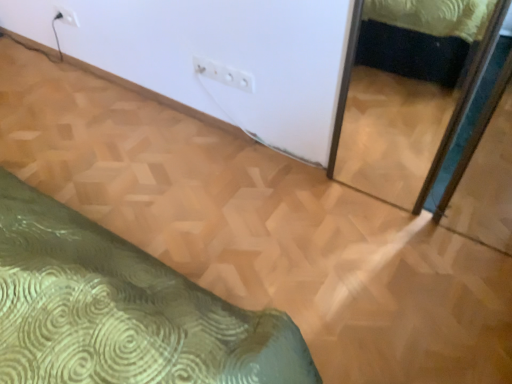
This screenshot has width=512, height=384. What do you see at coordinates (224, 74) in the screenshot?
I see `white plastic electric outlet at upper center, placed as the second electric outlet when sorted from left to right` at bounding box center [224, 74].

Locate an element on the screen. This screenshot has height=384, width=512. white plastic electric outlet at upper center, which appears as the 2th electric outlet when viewed from the top is located at coordinates (224, 74).

How much space does white plastic electric outlet at upper center, placed as the second electric outlet when sorted from left to right, occupy horizontally?

The width of white plastic electric outlet at upper center, placed as the second electric outlet when sorted from left to right, is 0.68 inches.

Find the location of a particular element. The width and height of the screenshot is (512, 384). white plastic electric outlet at upper left, which appears as the 2th electric outlet when viewed from the right is located at coordinates (66, 16).

Describe the element at coordinates (66, 16) in the screenshot. I see `white plastic electric outlet at upper left, the second electric outlet when ordered from bottom to top` at that location.

This screenshot has height=384, width=512. Find the location of `white plastic electric outlet at upper center, which appears as the second electric outlet when viewed from the back`. white plastic electric outlet at upper center, which appears as the second electric outlet when viewed from the back is located at coordinates (224, 74).

Between white plastic electric outlet at upper left, which ranks as the 1th electric outlet in back-to-front order, and white plastic electric outlet at upper center, which appears as the 2th electric outlet when viewed from the top, which one appears on the left side from the viewer's perspective?

Positioned to the left is white plastic electric outlet at upper left, which ranks as the 1th electric outlet in back-to-front order.

Which object is closer to the camera taking this photo, white plastic electric outlet at upper left, which is the second electric outlet in front-to-back order, or white plastic electric outlet at upper center, which appears as the 2th electric outlet when viewed from the top?

white plastic electric outlet at upper center, which appears as the 2th electric outlet when viewed from the top, is more forward.

Which is behind, point (68, 14) or point (246, 83)?

The point (68, 14) is farther from the camera.

Looking at this image, from the image's perspective, does white plastic electric outlet at upper left, which ranks as the 1th electric outlet in back-to-front order, appear lower than white plastic electric outlet at upper center, placed as the second electric outlet when sorted from left to right?

No, from the image's perspective, white plastic electric outlet at upper left, which ranks as the 1th electric outlet in back-to-front order, is not beneath white plastic electric outlet at upper center, placed as the second electric outlet when sorted from left to right.

From a real-world perspective, is white plastic electric outlet at upper left, which ranks as the 1th electric outlet in back-to-front order, located higher than white plastic electric outlet at upper center, the 1th electric outlet positioned from the front?

No, from a real-world perspective, white plastic electric outlet at upper left, which ranks as the 1th electric outlet in back-to-front order, is not on top of white plastic electric outlet at upper center, the 1th electric outlet positioned from the front.

Does white plastic electric outlet at upper left, which appears as the 2th electric outlet when viewed from the right, have a greater width compared to white plastic electric outlet at upper center, the first electric outlet from the right?

In fact, white plastic electric outlet at upper left, which appears as the 2th electric outlet when viewed from the right, might be narrower than white plastic electric outlet at upper center, the first electric outlet from the right.

Based on the photo, is white plastic electric outlet at upper left, which ranks as the first electric outlet in left-to-right order, taller or shorter than white plastic electric outlet at upper center, the 1th electric outlet positioned from the front?

Clearly, white plastic electric outlet at upper left, which ranks as the first electric outlet in left-to-right order, is shorter compared to white plastic electric outlet at upper center, the 1th electric outlet positioned from the front.

Considering the sizes of objects white plastic electric outlet at upper left, which ranks as the first electric outlet in left-to-right order, and white plastic electric outlet at upper center, the first electric outlet from the right, in the image provided, who is bigger, white plastic electric outlet at upper left, which ranks as the first electric outlet in left-to-right order, or white plastic electric outlet at upper center, the first electric outlet from the right,?

With larger size is white plastic electric outlet at upper center, the first electric outlet from the right.

Is white plastic electric outlet at upper left, which ranks as the first electric outlet in left-to-right order, not inside white plastic electric outlet at upper center, which appears as the second electric outlet when viewed from the back?

Yes.

Is white plastic electric outlet at upper left, which is counted as the first electric outlet, starting from the top, far away from white plastic electric outlet at upper center, the 1th electric outlet positioned from the front?

white plastic electric outlet at upper left, which is counted as the first electric outlet, starting from the top, is near white plastic electric outlet at upper center, the 1th electric outlet positioned from the front, not far away.

Could you tell me if white plastic electric outlet at upper left, which ranks as the first electric outlet in left-to-right order, is facing white plastic electric outlet at upper center, which is the first electric outlet in bottom-to-top order?

No, white plastic electric outlet at upper left, which ranks as the first electric outlet in left-to-right order, is not aimed at white plastic electric outlet at upper center, which is the first electric outlet in bottom-to-top order.

Where is `electric outlet that is under the white plastic electric outlet at upper center, the first electric outlet from the right (from a real-world perspective)`? Image resolution: width=512 pixels, height=384 pixels. electric outlet that is under the white plastic electric outlet at upper center, the first electric outlet from the right (from a real-world perspective) is located at coordinates (66, 16).

From the picture: Does white plastic electric outlet at upper center, placed as the second electric outlet when sorted from left to right, appear on the left side of white plastic electric outlet at upper left, the second electric outlet when ordered from bottom to top?

No, white plastic electric outlet at upper center, placed as the second electric outlet when sorted from left to right, is not to the left of white plastic electric outlet at upper left, the second electric outlet when ordered from bottom to top.

Which object is further away from the camera taking this photo, white plastic electric outlet at upper center, the first electric outlet from the right, or white plastic electric outlet at upper left, the second electric outlet when ordered from bottom to top?

Positioned behind is white plastic electric outlet at upper left, the second electric outlet when ordered from bottom to top.

Does point (196, 71) come closer to viewer compared to point (75, 14)?

Yes, point (196, 71) is in front of point (75, 14).

From the image's perspective, relative to white plastic electric outlet at upper left, which ranks as the first electric outlet in left-to-right order, is white plastic electric outlet at upper center, which appears as the second electric outlet when viewed from the back, above or below?

Clearly, from the image's perspective, white plastic electric outlet at upper center, which appears as the second electric outlet when viewed from the back, is below white plastic electric outlet at upper left, which ranks as the first electric outlet in left-to-right order.

From a real-world perspective, does white plastic electric outlet at upper center, which appears as the 2th electric outlet when viewed from the top, stand above white plastic electric outlet at upper left, which is counted as the first electric outlet, starting from the top?

Yes, from a real-world perspective, white plastic electric outlet at upper center, which appears as the 2th electric outlet when viewed from the top, is above white plastic electric outlet at upper left, which is counted as the first electric outlet, starting from the top.

Which of these two, white plastic electric outlet at upper center, the first electric outlet from the right, or white plastic electric outlet at upper left, which ranks as the first electric outlet in left-to-right order, is wider?

white plastic electric outlet at upper center, the first electric outlet from the right.

Which of these two, white plastic electric outlet at upper center, the 1th electric outlet positioned from the front, or white plastic electric outlet at upper left, which ranks as the 1th electric outlet in back-to-front order, stands shorter?

With less height is white plastic electric outlet at upper left, which ranks as the 1th electric outlet in back-to-front order.

Can you confirm if white plastic electric outlet at upper center, the 1th electric outlet positioned from the front, is smaller than white plastic electric outlet at upper left, which appears as the 2th electric outlet when viewed from the right?

No.

Is white plastic electric outlet at upper left, which ranks as the 1th electric outlet in back-to-front order, surrounded by white plastic electric outlet at upper center, placed as the second electric outlet when sorted from left to right?

No, white plastic electric outlet at upper left, which ranks as the 1th electric outlet in back-to-front order, is located outside of white plastic electric outlet at upper center, placed as the second electric outlet when sorted from left to right.

Is white plastic electric outlet at upper center, placed as the second electric outlet when sorted from left to right, far from white plastic electric outlet at upper left, which appears as the 2th electric outlet when viewed from the right?

Actually, white plastic electric outlet at upper center, placed as the second electric outlet when sorted from left to right, and white plastic electric outlet at upper left, which appears as the 2th electric outlet when viewed from the right, are a little close together.

Is white plastic electric outlet at upper center, placed as the second electric outlet when sorted from left to right, oriented towards white plastic electric outlet at upper left, which is the second electric outlet in front-to-back order?

No.

What's the angular difference between white plastic electric outlet at upper center, which appears as the second electric outlet when viewed from the back, and white plastic electric outlet at upper left, which ranks as the first electric outlet in left-to-right order,'s facing directions?

0.655 degrees separate the facing orientations of white plastic electric outlet at upper center, which appears as the second electric outlet when viewed from the back, and white plastic electric outlet at upper left, which ranks as the first electric outlet in left-to-right order.

Where is `electric outlet on the left of white plastic electric outlet at upper center, which appears as the 2th electric outlet when viewed from the top`? electric outlet on the left of white plastic electric outlet at upper center, which appears as the 2th electric outlet when viewed from the top is located at coordinates point(66,16).

Find the location of a particular element. The width and height of the screenshot is (512, 384). electric outlet on the left of white plastic electric outlet at upper center, which appears as the second electric outlet when viewed from the back is located at coordinates (66, 16).

You are a GUI agent. You are given a task and a screenshot of the screen. Output one action in this format:
    pyautogui.click(x=<x>, y=<y>)
    Task: Click on the electric outlet that is under the white plastic electric outlet at upper center, the 1th electric outlet positioned from the front (from a real-world perspective)
    The image size is (512, 384).
    Given the screenshot: What is the action you would take?
    pyautogui.click(x=66, y=16)